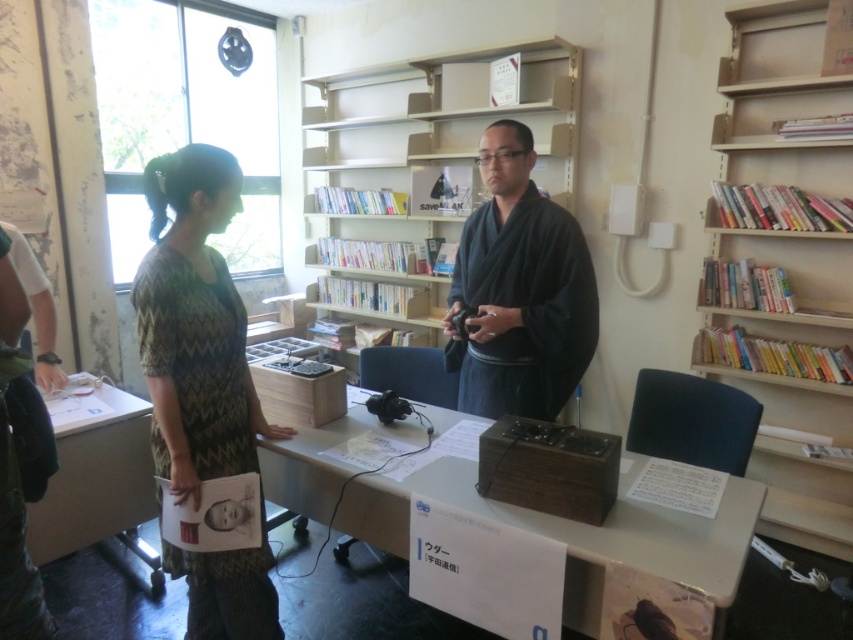
You are organizing a small event in the room and need to move the patterned fabric dress at left closer to the light beige wooden bookcase at upper center. How much space do you have to work with between them?

The patterned fabric dress at left and the light beige wooden bookcase at upper center are 7.05 feet apart, so you have 7.05 feet of space to work with between them.

You are organizing a small event in this room and need to move a 30 inch wide banner between the wooden table at center and the white glossy table at lower left. Can the banner fit through the space between them?

The wooden table at center and white glossy table at lower left are 30.72 inches apart from each other. Since the banner is 30 inches wide, it can fit through the space between them as the distance is slightly larger than the banner.